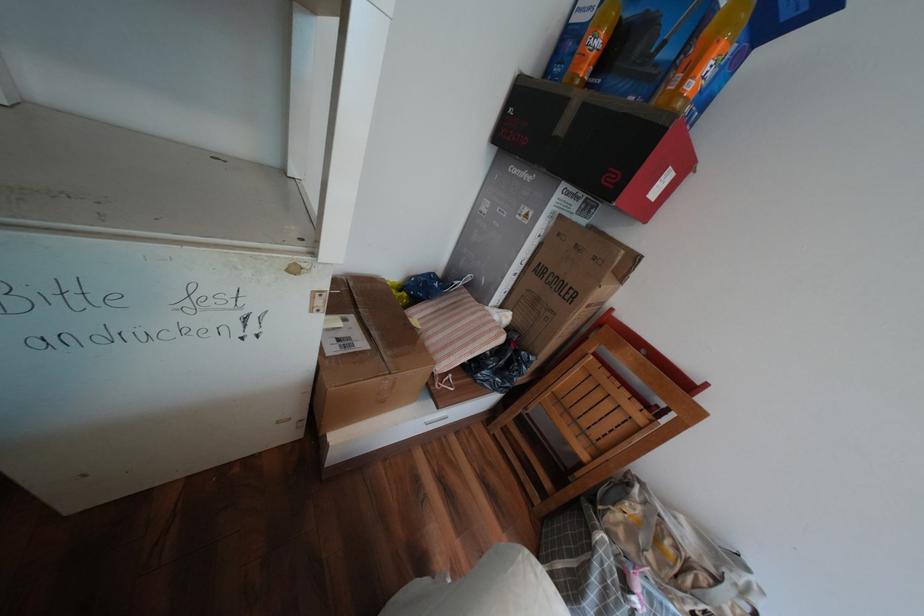
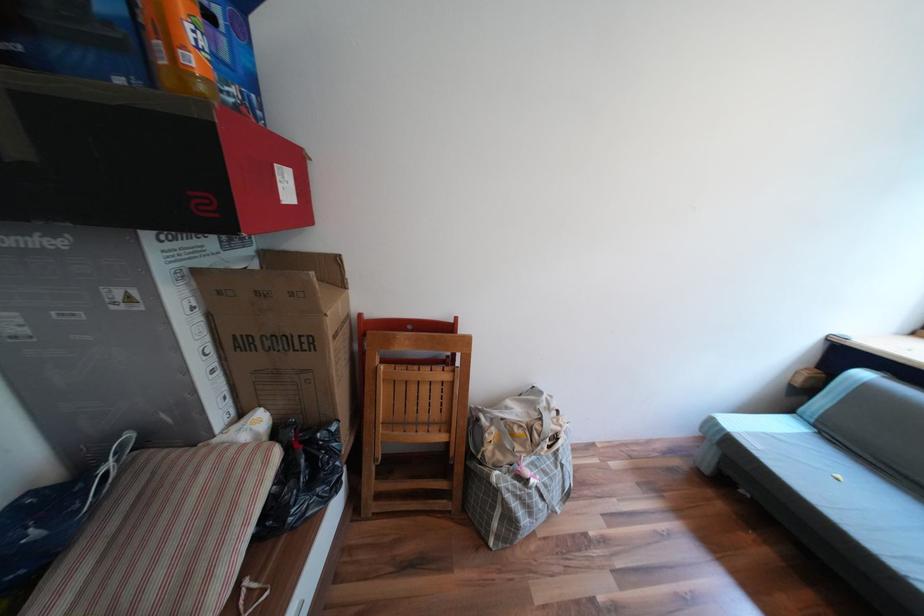
The point at (533, 262) is marked in the first image. Where is the corresponding point in the second image?

(219, 349)